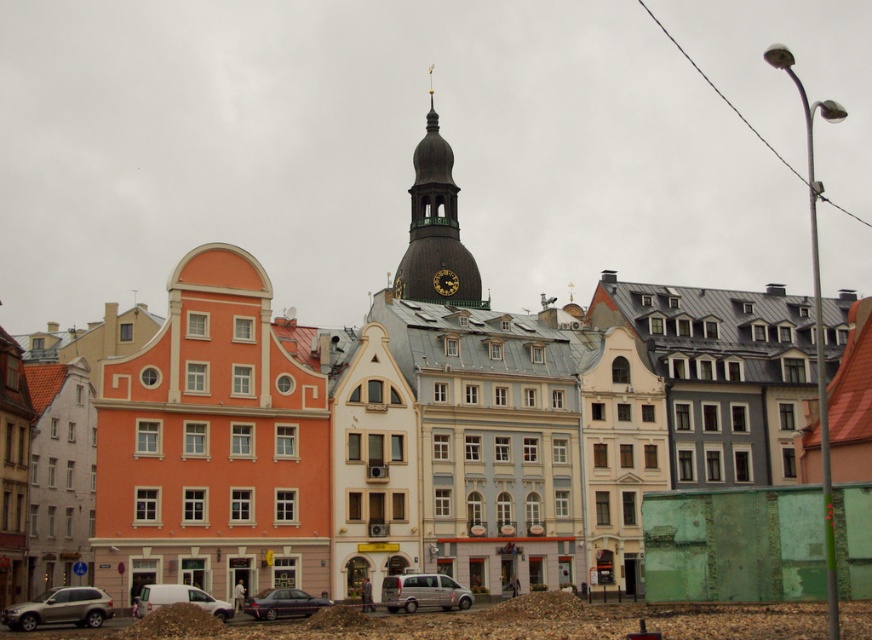
Question: Which of these objects is positioned closest to the silver metallic suv at lower left?

Choices:
 (A) dark brown wood clock tower at center
 (B) gold metallic clock at center

Answer: (A)

Question: Is the position of silver metallic suv at lower left more distant than that of gold metallic clock at center?

Choices:
 (A) yes
 (B) no

Answer: (B)

Question: Which object is farther from the camera taking this photo?

Choices:
 (A) dark brown wood clock tower at center
 (B) metallic gray sedan at center

Answer: (A)

Question: Is white matte van at lower left thinner than gold metallic clock at center?

Choices:
 (A) yes
 (B) no

Answer: (A)

Question: Among these objects, which one is nearest to the camera?

Choices:
 (A) white matte van at lower left
 (B) silver metallic van at center

Answer: (A)

Question: Is orange matte building at left to the left of gold metallic clock at center from the viewer's perspective?

Choices:
 (A) no
 (B) yes

Answer: (B)